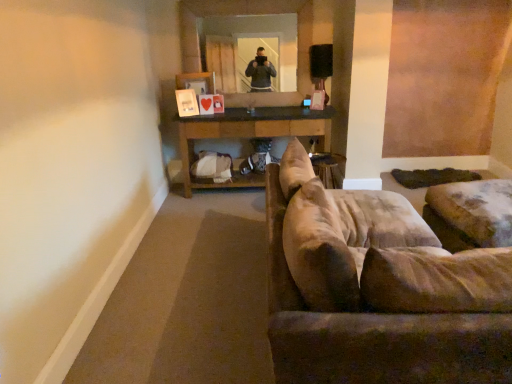
Question: Considering the relative positions of clear glass mirror at upper center and suede-like beige couch at right in the image provided, is clear glass mirror at upper center to the left or to the right of suede-like beige couch at right?

Choices:
 (A) left
 (B) right

Answer: (A)

Question: From a real-world perspective, is clear glass mirror at upper center physically located above or below suede-like beige couch at right?

Choices:
 (A) above
 (B) below

Answer: (A)

Question: Based on their relative distances, which object is nearer to the clear glass mirror at upper center?

Choices:
 (A) brown wooden table at center
 (B) suede-like beige couch at right

Answer: (A)

Question: Estimate the real-world distances between objects in this image. Which object is farther from the clear glass mirror at upper center?

Choices:
 (A) suede-like beige couch at right
 (B) brown wooden table at center

Answer: (A)